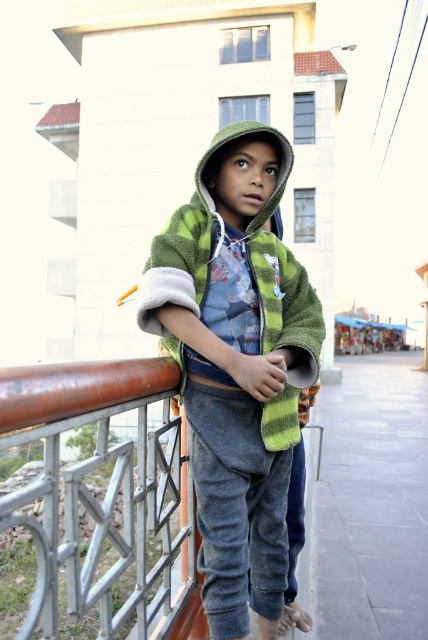
Is point (113, 634) closer to camera compared to point (296, 276)?

Yes, point (113, 634) is closer to viewer.

Is rusty metal fence at left shorter than green fuzzy jacket at center?

Incorrect, rusty metal fence at left's height does not fall short of green fuzzy jacket at center's.

Is point (169, 412) positioned before point (291, 372)?

No.

At what (x,y) coordinates should I click in order to perform the action: click on rusty metal fence at left. Please return your answer as a coordinate pair (x, y). Looking at the image, I should click on (104, 493).